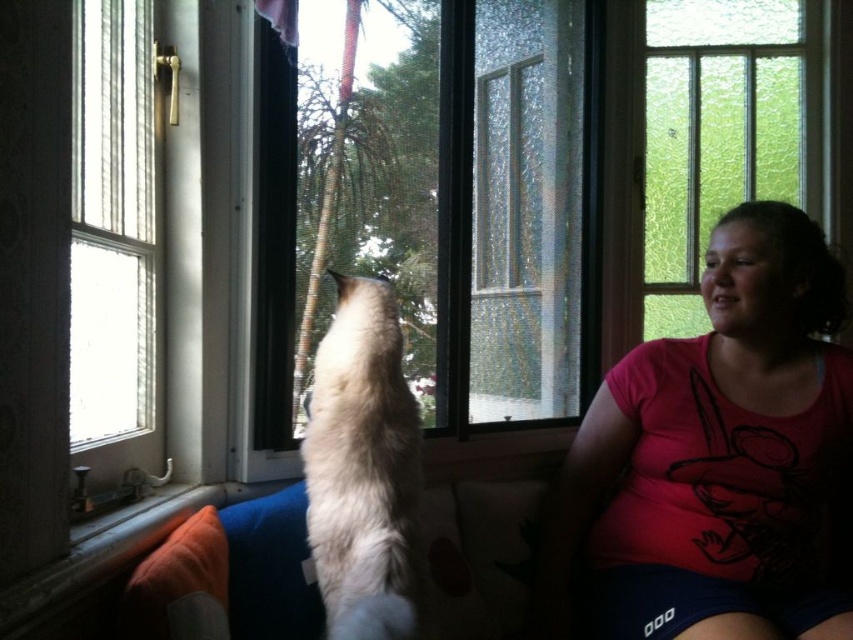
You are a photographer trying to capture a photo of the white fluffy cat at center. To get the best lighting, you need to position yourself so that the light from the window illuminates the cat without casting a shadow on the pink cotton shirt at right. Based on the scene description, where should you stand relative to the cat?

The pink cotton shirt at right is below the white fluffy cat at center. Therefore, to avoid casting a shadow on the shirt, you should position yourself so that the light from the window is coming from above the cat, ensuring the shadow falls away from the shirt below.

You are trying to take a photo of the transparent glass window at center through the frosted glass section on the right side. Will the photo show the view outside clearly?

The transparent glass window at center is located at point (431, 209), which is not on the frosted glass section on the right side. Therefore, the photo taken through the frosted glass section would not show the view outside clearly since the frosted part diffuses the light and obscures the view.

You are a photographer wanting to capture the reflection of the pink cotton shirt at right in the clear glass window at left. Is the shirt positioned in a way that its reflection would appear in the window?

The pink cotton shirt at right is located below the clear glass window at left, so its reflection would appear in the window since the shirt is positioned below it.